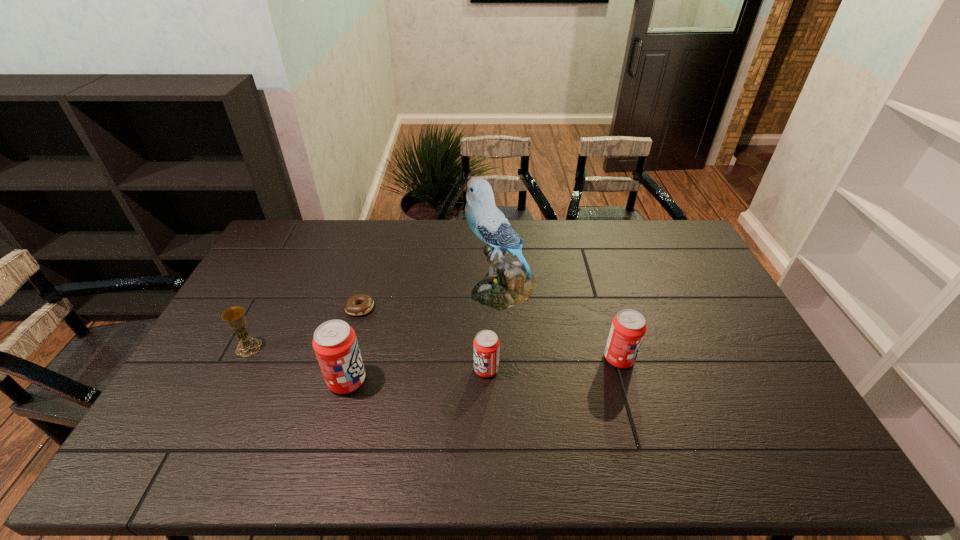
What are the coordinates of `vacant space situated 0.140m on the surface of the shortest soda can` in the screenshot? It's located at (423, 369).

At what (x,y) coordinates should I click in order to perform the action: click on free space located 0.220m on the surface of the shortest soda can. Please return your answer as a coordinate pair (x, y). The image size is (960, 540). Looking at the image, I should click on (396, 369).

Identify the location of vacant space located on the surface of the second shortest soda can. Image resolution: width=960 pixels, height=540 pixels. (714, 358).

Image resolution: width=960 pixels, height=540 pixels. Find the location of `free region located 0.140m on the face of the tallest object`. free region located 0.140m on the face of the tallest object is located at coordinates (425, 289).

What are the coordinates of `free space located on the face of the tallest object` in the screenshot? It's located at (431, 289).

Where is `vacant space located 0.260m on the face of the tallest object`? This screenshot has height=540, width=960. vacant space located 0.260m on the face of the tallest object is located at coordinates (390, 289).

Identify the location of free region located 0.160m on the back of the chalice. (273, 301).

The height and width of the screenshot is (540, 960). What are the coordinates of `blank area located 0.190m on the front of the shortest object` in the screenshot? It's located at (343, 367).

Identify the location of object present at the near edge. (335, 344).

At what (x,y) coordinates should I click in order to perform the action: click on object that is at the left edge. Please return your answer as a coordinate pair (x, y). The image size is (960, 540). Looking at the image, I should click on click(x=235, y=318).